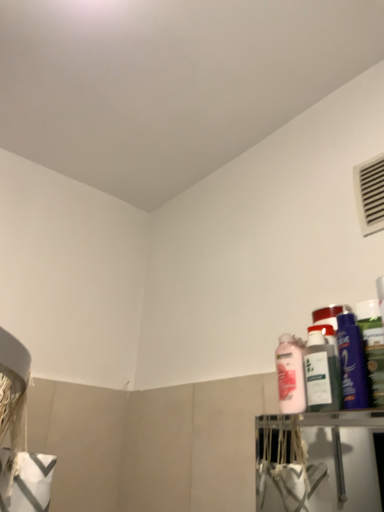
Where is `white plastic air conditioning at upper right`? white plastic air conditioning at upper right is located at coordinates (370, 194).

You are a GUI agent. You are given a task and a screenshot of the screen. Output one action in this format:
    pyautogui.click(x=<x>, y=<y>)
    Task: Click on the green matte bottle at right, which ranks as the third cleaning product in left-to-right order
    Image resolution: width=384 pixels, height=512 pixels.
    Given the screenshot: What is the action you would take?
    pyautogui.click(x=373, y=348)

Locate an element on the screen. This screenshot has width=384, height=512. shiny purple bottle at right, which is counted as the second cleaning product, starting from the left is located at coordinates (352, 362).

Describe the element at coordinates (321, 373) in the screenshot. I see `pink matte bottle at upper right` at that location.

Locate an element on the screen. This screenshot has width=384, height=512. pink glossy lotion at right, marked as the first cleaning product in a left-to-right arrangement is located at coordinates coord(290,374).

From the image's perspective, is pink glossy lotion at right, marked as the first cleaning product in a left-to-right arrangement, positioned above or below pink matte bottle at upper right?

Clearly, from the image's perspective, pink glossy lotion at right, marked as the first cleaning product in a left-to-right arrangement, is below pink matte bottle at upper right.

Between pink glossy lotion at right, marked as the first cleaning product in a left-to-right arrangement, and pink matte bottle at upper right, which one appears on the right side from the viewer's perspective?

pink matte bottle at upper right.

Which object is further away from the camera, pink glossy lotion at right, marked as the first cleaning product in a left-to-right arrangement, or pink matte bottle at upper right?

pink glossy lotion at right, marked as the first cleaning product in a left-to-right arrangement, is further from the camera.

Is pink glossy lotion at right, positioned as the third cleaning product in right-to-left order, not inside pink matte bottle at upper right?

pink glossy lotion at right, positioned as the third cleaning product in right-to-left order, is positioned outside pink matte bottle at upper right.

In the scene shown: Which is more to the right, pink matte bottle at upper right or green matte bottle at right, which ranks as the third cleaning product in left-to-right order?

green matte bottle at right, which ranks as the third cleaning product in left-to-right order, is more to the right.

Measure the distance from pink matte bottle at upper right to green matte bottle at right, which ranks as the third cleaning product in left-to-right order.

The distance of pink matte bottle at upper right from green matte bottle at right, which ranks as the third cleaning product in left-to-right order, is 3.29 inches.

Is pink matte bottle at upper right not inside green matte bottle at right, which ranks as the third cleaning product in left-to-right order?

Yes, pink matte bottle at upper right is outside of green matte bottle at right, which ranks as the third cleaning product in left-to-right order.

From a real-world perspective, is pink matte bottle at upper right physically above green matte bottle at right, which ranks as the third cleaning product in left-to-right order?

No, from a real-world perspective, pink matte bottle at upper right is not above green matte bottle at right, which ranks as the third cleaning product in left-to-right order.

Which is more to the left, shiny purple bottle at right, which is counted as the second cleaning product, starting from the left, or white plastic air conditioning at upper right?

From the viewer's perspective, shiny purple bottle at right, which is counted as the second cleaning product, starting from the left, appears more on the left side.

Does shiny purple bottle at right, the 2th cleaning product from the right, touch white plastic air conditioning at upper right?

No, shiny purple bottle at right, the 2th cleaning product from the right, is not beside white plastic air conditioning at upper right.

Between shiny purple bottle at right, the 2th cleaning product from the right, and white plastic air conditioning at upper right, which one is positioned behind?

Positioned behind is white plastic air conditioning at upper right.

Is point (349, 343) closer to camera compared to point (372, 185)?

That is True.

Considering the sizes of objects pink glossy lotion at right, positioned as the third cleaning product in right-to-left order, and white plastic air conditioning at upper right in the image provided, who is bigger, pink glossy lotion at right, positioned as the third cleaning product in right-to-left order, or white plastic air conditioning at upper right?

white plastic air conditioning at upper right is bigger.

Is white plastic air conditioning at upper right at the back of pink glossy lotion at right, positioned as the third cleaning product in right-to-left order?

No.

Are pink glossy lotion at right, positioned as the third cleaning product in right-to-left order, and white plastic air conditioning at upper right far apart?

Actually, pink glossy lotion at right, positioned as the third cleaning product in right-to-left order, and white plastic air conditioning at upper right are a little close together.

You are a GUI agent. You are given a task and a screenshot of the screen. Output one action in this format:
    pyautogui.click(x=<x>, y=<y>)
    Task: Click on the air conditioning behind the shiny purple bottle at right, which is counted as the second cleaning product, starting from the left
    This screenshot has width=384, height=512.
    Given the screenshot: What is the action you would take?
    pyautogui.click(x=370, y=194)

Between white plastic air conditioning at upper right and shiny purple bottle at right, which is counted as the second cleaning product, starting from the left, which one has smaller width?

With smaller width is white plastic air conditioning at upper right.

Would you consider white plastic air conditioning at upper right to be distant from shiny purple bottle at right, the 2th cleaning product from the right?

That's not correct — white plastic air conditioning at upper right is a little close to shiny purple bottle at right, the 2th cleaning product from the right.

How much distance is there between white plastic air conditioning at upper right and shiny purple bottle at right, which is counted as the second cleaning product, starting from the left?

A distance of 12.52 inches exists between white plastic air conditioning at upper right and shiny purple bottle at right, which is counted as the second cleaning product, starting from the left.

Is the surface of shiny purple bottle at right, which is counted as the second cleaning product, starting from the left, in direct contact with pink glossy lotion at right, positioned as the third cleaning product in right-to-left order?

No, shiny purple bottle at right, which is counted as the second cleaning product, starting from the left, is not in contact with pink glossy lotion at right, positioned as the third cleaning product in right-to-left order.

Does point (350, 330) lie behind point (296, 345)?

No.

Can you tell me how much shiny purple bottle at right, the 2th cleaning product from the right, and pink glossy lotion at right, positioned as the third cleaning product in right-to-left order, differ in facing direction?

The angular difference between shiny purple bottle at right, the 2th cleaning product from the right, and pink glossy lotion at right, positioned as the third cleaning product in right-to-left order, is 0.00466 degrees.

From the image's perspective, is shiny purple bottle at right, the 2th cleaning product from the right, located above or below pink glossy lotion at right, positioned as the third cleaning product in right-to-left order?

shiny purple bottle at right, the 2th cleaning product from the right, is situated higher than pink glossy lotion at right, positioned as the third cleaning product in right-to-left order, in the image.

Who is bigger, pink glossy lotion at right, positioned as the third cleaning product in right-to-left order, or green matte bottle at right, which ranks as the 1th cleaning product in right-to-left order?

pink glossy lotion at right, positioned as the third cleaning product in right-to-left order, is bigger.

In terms of width, does pink glossy lotion at right, marked as the first cleaning product in a left-to-right arrangement, look wider or thinner when compared to green matte bottle at right, which ranks as the third cleaning product in left-to-right order?

Clearly, pink glossy lotion at right, marked as the first cleaning product in a left-to-right arrangement, has more width compared to green matte bottle at right, which ranks as the third cleaning product in left-to-right order.

Looking at this image, does pink glossy lotion at right, positioned as the third cleaning product in right-to-left order, lie in front of green matte bottle at right, which ranks as the third cleaning product in left-to-right order?

No, it is not.

From a real-world perspective, which cleaning product is the 1st one above the pink matte bottle at upper right? Please provide its 2D coordinates.

[(290, 374)]

Image resolution: width=384 pixels, height=512 pixels. I want to click on bottle that is behind the green matte bottle at right, which ranks as the 1th cleaning product in right-to-left order, so click(x=321, y=373).

Which object lies nearer to the anchor point white plastic air conditioning at upper right, pink matte bottle at upper right or green matte bottle at right, which ranks as the 1th cleaning product in right-to-left order?

green matte bottle at right, which ranks as the 1th cleaning product in right-to-left order, is positioned closer to the anchor white plastic air conditioning at upper right.

From the image, which object appears to be farther from white plastic air conditioning at upper right, green matte bottle at right, which ranks as the third cleaning product in left-to-right order, or pink glossy lotion at right, positioned as the third cleaning product in right-to-left order?

pink glossy lotion at right, positioned as the third cleaning product in right-to-left order, lies further to white plastic air conditioning at upper right than the other object.

From the image, which object appears to be nearer to white plastic air conditioning at upper right, pink glossy lotion at right, marked as the first cleaning product in a left-to-right arrangement, or shiny purple bottle at right, which is counted as the second cleaning product, starting from the left?

shiny purple bottle at right, which is counted as the second cleaning product, starting from the left, is closer to white plastic air conditioning at upper right.

Looking at the image, which one is located closer to shiny purple bottle at right, which is counted as the second cleaning product, starting from the left, pink matte bottle at upper right or white plastic air conditioning at upper right?

pink matte bottle at upper right is closer to shiny purple bottle at right, which is counted as the second cleaning product, starting from the left.

Based on their spatial positions, is pink glossy lotion at right, marked as the first cleaning product in a left-to-right arrangement, or pink matte bottle at upper right further from white plastic air conditioning at upper right?

The object further to white plastic air conditioning at upper right is pink glossy lotion at right, marked as the first cleaning product in a left-to-right arrangement.

Estimate the real-world distances between objects in this image. Which object is closer to pink glossy lotion at right, positioned as the third cleaning product in right-to-left order, white plastic air conditioning at upper right or shiny purple bottle at right, the 2th cleaning product from the right?

Among the two, shiny purple bottle at right, the 2th cleaning product from the right, is located nearer to pink glossy lotion at right, positioned as the third cleaning product in right-to-left order.

Based on their spatial positions, is pink glossy lotion at right, marked as the first cleaning product in a left-to-right arrangement, or white plastic air conditioning at upper right closer to green matte bottle at right, which ranks as the third cleaning product in left-to-right order?

pink glossy lotion at right, marked as the first cleaning product in a left-to-right arrangement, is closer to green matte bottle at right, which ranks as the third cleaning product in left-to-right order.

From the image, which object appears to be farther from shiny purple bottle at right, the 2th cleaning product from the right, white plastic air conditioning at upper right or pink matte bottle at upper right?

white plastic air conditioning at upper right is further to shiny purple bottle at right, the 2th cleaning product from the right.

Where is `bottle between white plastic air conditioning at upper right and pink glossy lotion at right, positioned as the third cleaning product in right-to-left order, in the up-down direction`? Image resolution: width=384 pixels, height=512 pixels. bottle between white plastic air conditioning at upper right and pink glossy lotion at right, positioned as the third cleaning product in right-to-left order, in the up-down direction is located at coordinates (321, 373).

At what (x,y) coordinates should I click in order to perform the action: click on cleaning product positioned between green matte bottle at right, which ranks as the third cleaning product in left-to-right order, and pink glossy lotion at right, marked as the first cleaning product in a left-to-right arrangement, from near to far. Please return your answer as a coordinate pair (x, y). Image resolution: width=384 pixels, height=512 pixels. Looking at the image, I should click on (352, 362).

Image resolution: width=384 pixels, height=512 pixels. Identify the location of cleaning product between white plastic air conditioning at upper right and shiny purple bottle at right, the 2th cleaning product from the right, from top to bottom. (373, 348).

Image resolution: width=384 pixels, height=512 pixels. Find the location of `bottle located between green matte bottle at right, which ranks as the 1th cleaning product in right-to-left order, and pink glossy lotion at right, positioned as the third cleaning product in right-to-left order, in the depth direction`. bottle located between green matte bottle at right, which ranks as the 1th cleaning product in right-to-left order, and pink glossy lotion at right, positioned as the third cleaning product in right-to-left order, in the depth direction is located at coordinates (x=321, y=373).